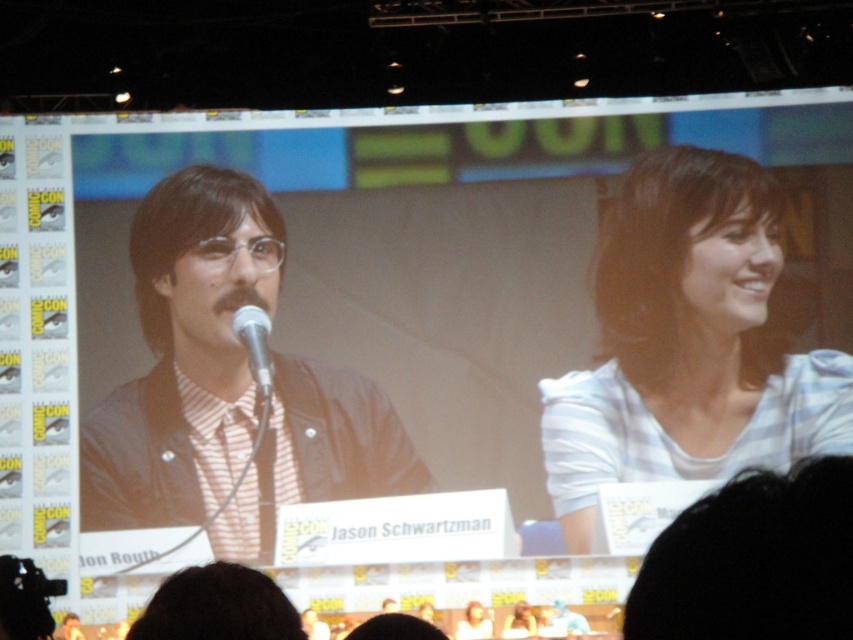
Question: Which point is closer to the camera?

Choices:
 (A) silver metallic microphone at center
 (B) white striped shirt at upper right
 (C) matte black jacket at left

Answer: (C)

Question: Does white striped shirt at upper right come in front of matte black jacket at left?

Choices:
 (A) yes
 (B) no

Answer: (B)

Question: Which is farther from the white striped shirt at upper right?

Choices:
 (A) silver metallic microphone at center
 (B) matte black jacket at left

Answer: (A)

Question: Can you confirm if matte black jacket at left is wider than silver metallic microphone at center?

Choices:
 (A) no
 (B) yes

Answer: (B)

Question: Considering the real-world distances, which object is farthest from the white striped shirt at upper right?

Choices:
 (A) matte black jacket at left
 (B) silver metallic microphone at center

Answer: (B)

Question: Does matte black jacket at left appear under silver metallic microphone at center?

Choices:
 (A) yes
 (B) no

Answer: (A)